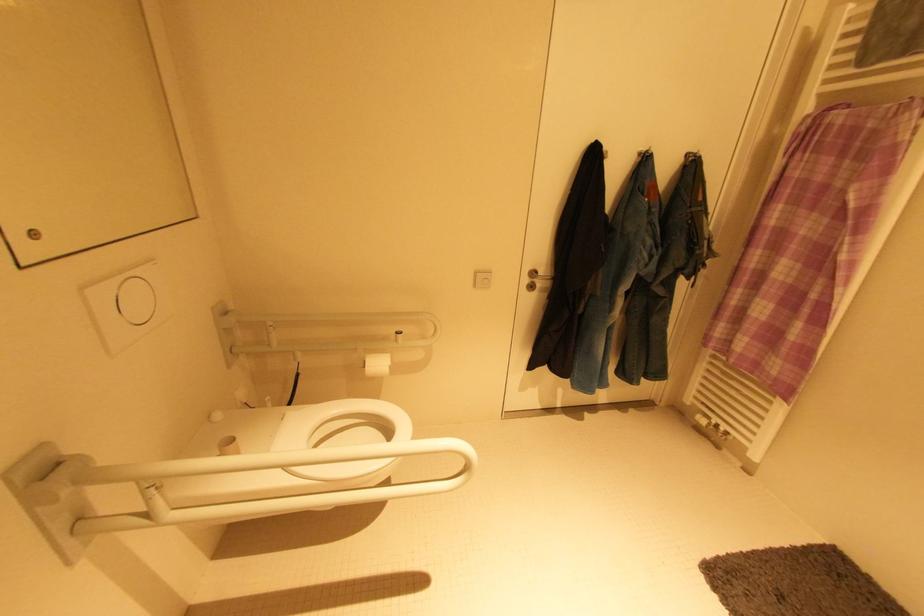
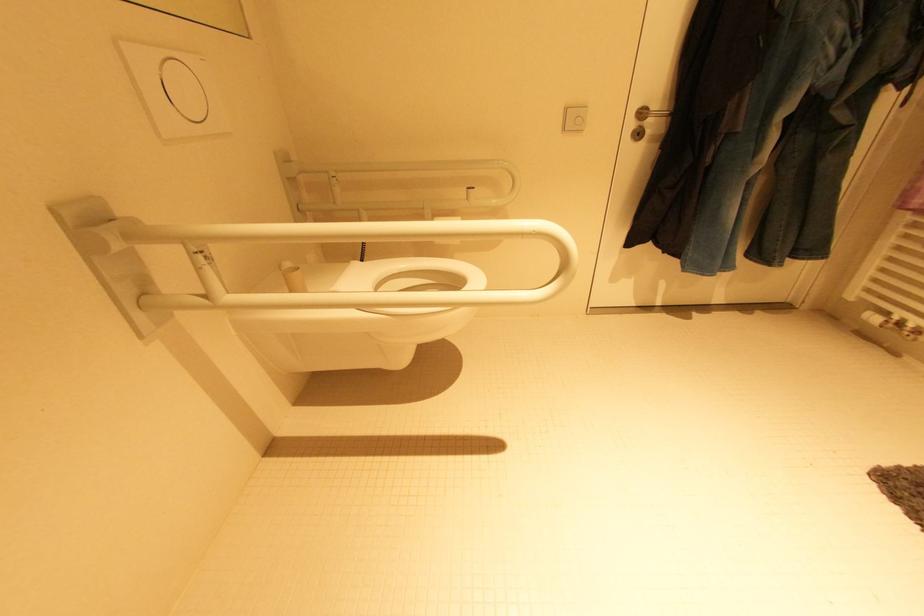
Question: The first image is from the beginning of the video and the second image is from the end. How did the camera likely rotate when shooting the video?

Choices:
 (A) Left
 (B) Right
 (C) Up
 (D) Down

Answer: (A)